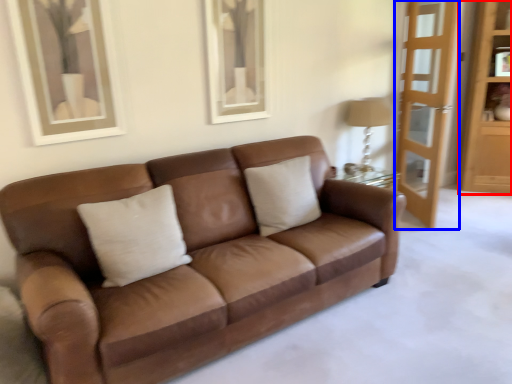
Question: Among these objects, which one is farthest to the camera, dresser (highlighted by a red box) or screen door (highlighted by a blue box)?

Choices:
 (A) dresser
 (B) screen door

Answer: (A)